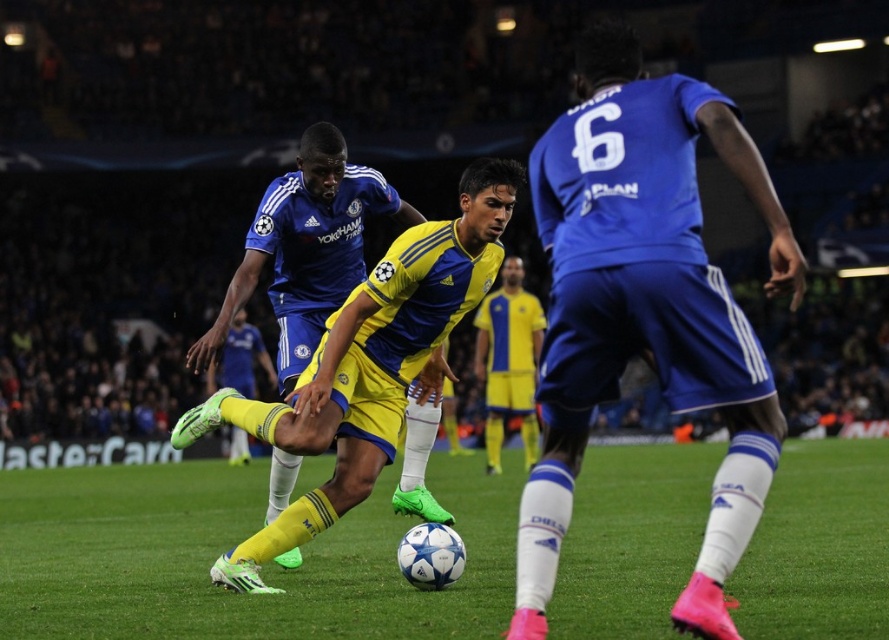
Who is higher up, yellow matte jersey at center or blue matte jersey at center?

yellow matte jersey at center is higher up.

I want to click on yellow matte jersey at center, so click(646, 307).

Find the location of a particular element. This screenshot has width=889, height=640. yellow matte jersey at center is located at coordinates (646, 307).

Can you confirm if green grass at center is smaller than yellow jersey at center?

Incorrect, green grass at center is not smaller in size than yellow jersey at center.

Which is behind, point (38, 532) or point (526, 413)?

The point (526, 413) is behind.

I want to click on green grass at center, so click(229, 545).

Who is positioned more to the left, blue jersey at center or yellow matte soccer cleat at center?

yellow matte soccer cleat at center

Can you confirm if blue jersey at center is thinner than yellow matte soccer cleat at center?

Yes.

Which is in front, point (253, 240) or point (245, 376)?

Point (253, 240) is more forward.

Locate an element on the screen. This screenshot has width=889, height=640. blue jersey at center is located at coordinates (305, 248).